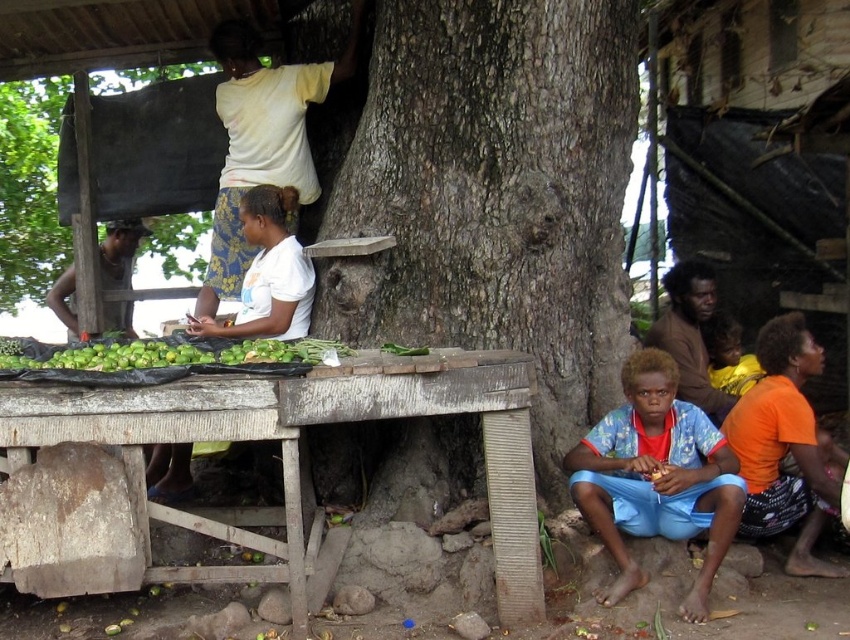
Between brown textured shirt at lower right and brown skin man at left, which one appears on the right side from the viewer's perspective?

From the viewer's perspective, brown textured shirt at lower right appears more on the right side.

Does brown textured shirt at lower right appear over brown skin man at left?

No, brown textured shirt at lower right is not above brown skin man at left.

Which is in front, point (717, 417) or point (105, 259)?

Point (717, 417) is in front.

Locate an element on the screen. The width and height of the screenshot is (850, 640). brown textured shirt at lower right is located at coordinates (690, 333).

Does point (677, 474) lie in front of point (179, 230)?

Yes, it is.

Looking at this image, is blue printed fabric at lower right behind brown rough tree trunk at upper center?

No, blue printed fabric at lower right is in front of brown rough tree trunk at upper center.

The height and width of the screenshot is (640, 850). I want to click on blue printed fabric at lower right, so click(656, 476).

Does wooden table at lower left come in front of orange fabric at lower right?

Yes, wooden table at lower left is in front of orange fabric at lower right.

Is wooden table at lower left below orange fabric at lower right?

Yes, wooden table at lower left is below orange fabric at lower right.

I want to click on wooden table at lower left, so click(299, 454).